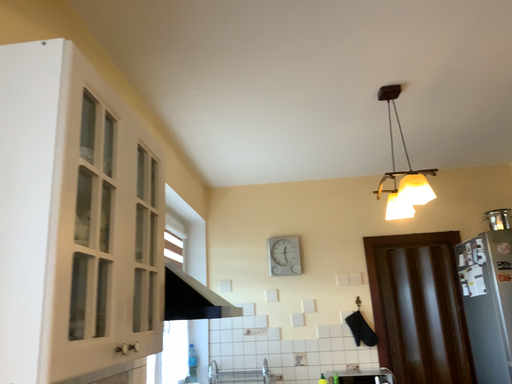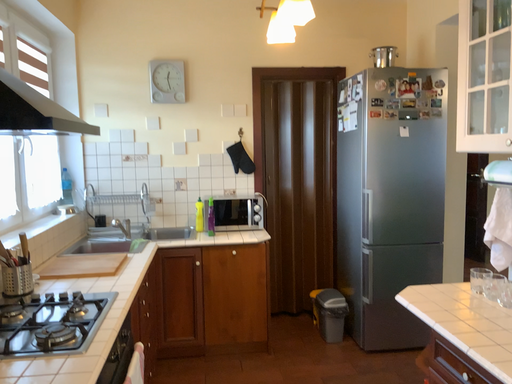
Question: Which way did the camera rotate in the video?

Choices:
 (A) rotated left
 (B) rotated right

Answer: (B)